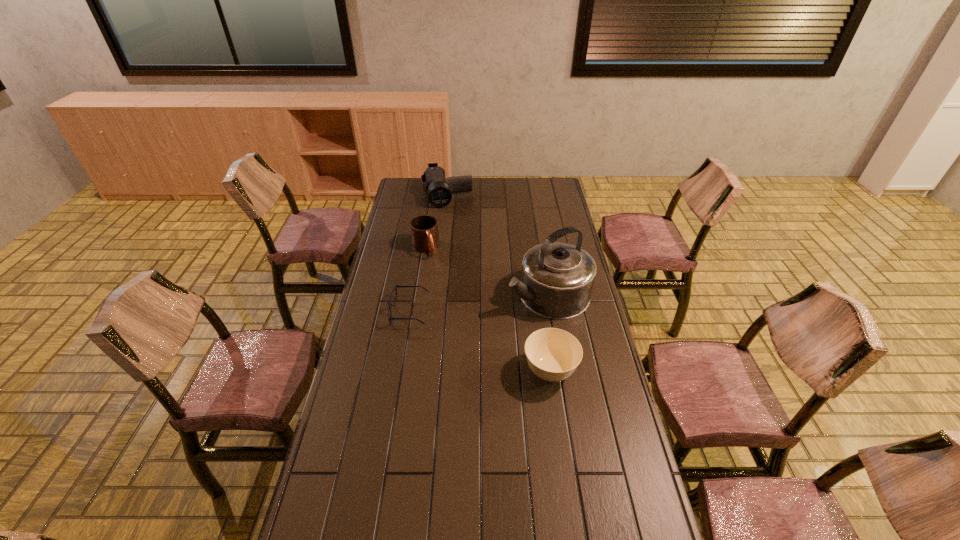
This screenshot has width=960, height=540. Find the location of `vacant space located 0.110m with the spout at the front of the tallest object`. vacant space located 0.110m with the spout at the front of the tallest object is located at coordinates (490, 318).

Identify the location of vacant space located with the spout at the front of the tallest object. The image size is (960, 540). (466, 329).

This screenshot has width=960, height=540. I want to click on vacant space located 0.400m with the spout at the front of the tallest object, so click(423, 348).

Identify the location of vacant point located on the side of the fourth nearest object with the handle. (452, 308).

What are the coordinates of `vacant point located 0.080m on the side of the fourth nearest object with the handle` in the screenshot? It's located at (434, 271).

This screenshot has width=960, height=540. Identify the location of free spot located on the side of the fourth nearest object with the handle. (440, 284).

The height and width of the screenshot is (540, 960). Identify the location of object that is at the far edge. (439, 192).

Locate an element on the screen. The height and width of the screenshot is (540, 960). spectacles present at the left edge is located at coordinates (389, 302).

Locate an element on the screen. The height and width of the screenshot is (540, 960). camcorder situated at the left edge is located at coordinates (439, 192).

Find the location of a particular element. The height and width of the screenshot is (540, 960). mug present at the left edge is located at coordinates (424, 229).